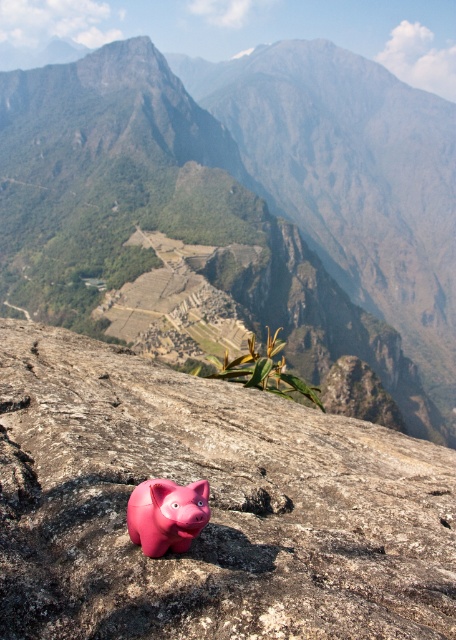
You are a small insect trying to climb from the pink rubber piggy bank at center to the matte gray rock at center. Is the rock above or below the piggy bank?

The matte gray rock at center is above the pink rubber piggy bank at center, so the rock is above the piggy bank.

From the picture: You are a geologist analyzing the coordinates of the matte gray rock at center in the image. What are its coordinates?

The coordinates of the matte gray rock at center are at point [242,205].